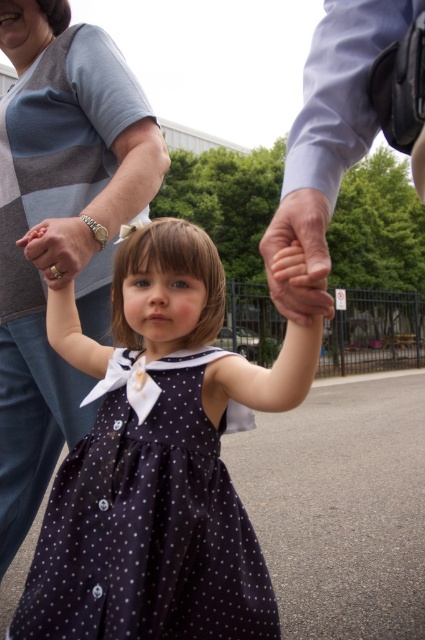
You are a photographer trying to capture a family portrait. You notice the two adults holding the girl are wearing a matte gray sweater at upper left and a light blue shirt at upper right. Based on their clothing sizes, which adult should you position closer to the center of the frame to balance the visual weight?

The matte gray sweater at upper left has a larger width than the light blue shirt at upper right. To balance the visual weight, position the adult in the matte gray sweater at upper left slightly farther from the center, while bringing the adult in the light blue shirt at upper right closer to the center. This creates equilibrium between the two figures.

You are a photographer setting up for a family portrait. The subjects include the girl in the navy blue dress and the two adults holding her hands. You need to position the matte gray sweater at upper left and the light blue shirt at upper right so that they are exactly 30 inches apart for the perfect shot. Based on their current positions, do you need to move them closer together or farther apart?

The matte gray sweater at upper left is currently 26.34 inches from the light blue shirt at upper right. To reach the desired 30 inches, they need to move farther apart by approximately 3.66 inches.